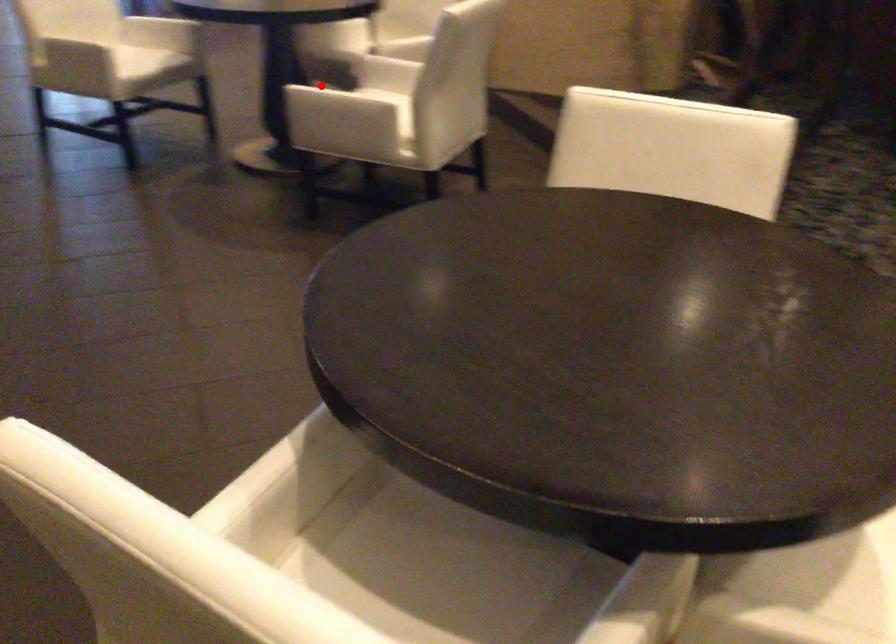
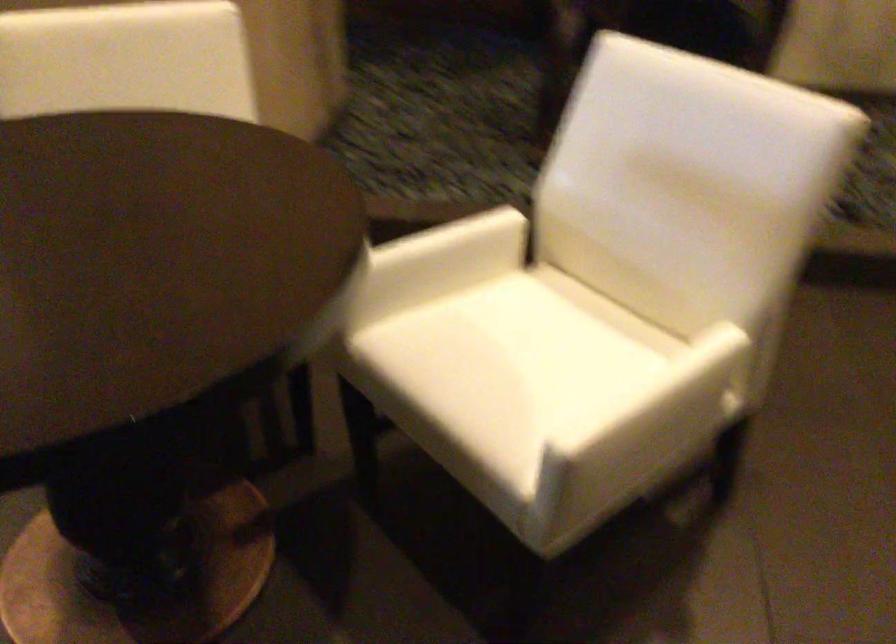
In the second image, find the point that corresponds to the highlighted location in the first image.

(684, 402)